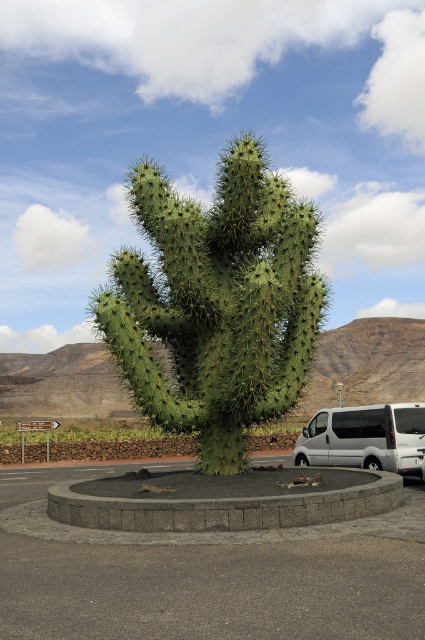
You are a delivery drone flying over a desert area and need to land on the gray concrete parking lot at center. However, there is a green spiny cactus at center in the way. Based on their positions, can you safely land on the parking lot without hitting the cactus?

The gray concrete parking lot at center is positioned on the left side of the green spiny cactus at center, so the cactus is to the right of the parking lot. Since the drone needs to land on the parking lot, it can safely land on the left side away from the cactus.

You are a gardener planning to replace the green spiny cactus at center with a larger one. Based on the space available, will the new cactus fit within the area occupied by the gray concrete curb at center?

The green spiny cactus at center currently occupies less space than the gray concrete curb at center. Therefore, a larger cactus could potentially fit within the area as long as it does not exceed the curb space.

You are standing at the point marked by the coordinates point (218, 301). Looking around, you see the green spiny cactus at center. Can you determine the direction of the cactus relative to your current position?

The green spiny cactus at center is located at the point marked by the coordinates point (218, 301), so you are standing exactly at the position of the cactus. Therefore, the cactus is right where you are standing.